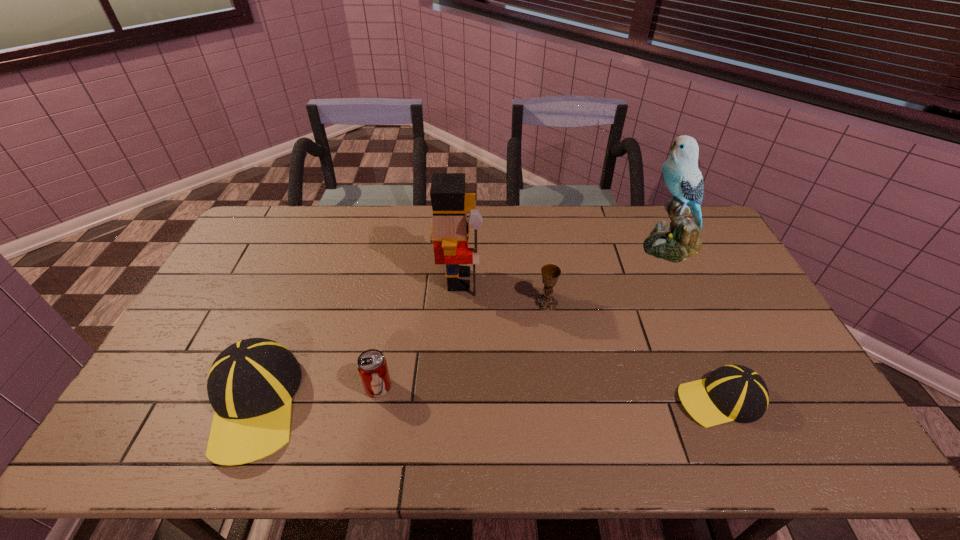
This screenshot has height=540, width=960. What are the coordinates of `free space between the taller baseball cap and the chalice` in the screenshot? It's located at coord(400,354).

Locate an element on the screen. free space between the parakeet and the taller baseball cap is located at coordinates (462, 325).

At what (x,y) coordinates should I click in order to perform the action: click on vacant area between the shortest object and the taller baseball cap. Please return your answer as a coordinate pair (x, y). The width and height of the screenshot is (960, 540). Looking at the image, I should click on (487, 402).

Where is `empty location between the second shortest object and the left baseball cap`? The image size is (960, 540). empty location between the second shortest object and the left baseball cap is located at coordinates (316, 396).

The height and width of the screenshot is (540, 960). I want to click on free spot between the third object from right to left and the taller baseball cap, so tap(400, 354).

Identify the location of free space between the fourth object from left to right and the fourth object from right to left. (503, 292).

Where is `free space between the parakeet and the left baseball cap`? Image resolution: width=960 pixels, height=540 pixels. free space between the parakeet and the left baseball cap is located at coordinates (462, 325).

At what (x,y) coordinates should I click in order to perform the action: click on free area in between the chalice and the parakeet. Please return your answer as a coordinate pair (x, y). This screenshot has height=540, width=960. Looking at the image, I should click on (609, 274).

The image size is (960, 540). I want to click on free spot between the fourth object from right to left and the fifth tallest object, so click(419, 334).

The width and height of the screenshot is (960, 540). Identify the location of object that stands as the fifth closest to the pop soda. (680, 240).